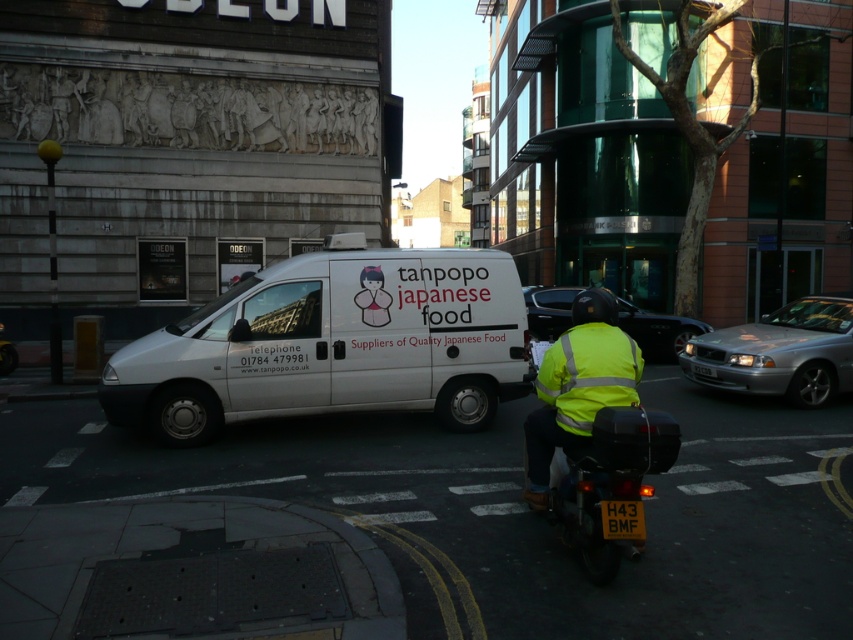
You are a delivery driver who needs to park your van between the silver metallic sedan at right and the high visibility yellow fabric safety vest at center. Can you fit your van there?

The silver metallic sedan at right is wider than the high visibility yellow fabric safety vest at center, so there is enough space between them to fit your van.

You are a pedestrian on the sidewalk and see both the high visibility yellow jacket at center and the high visibility yellow fabric safety vest at center. Which one is larger in size?

The high visibility yellow jacket at center is bigger than the high visibility yellow fabric safety vest at center.